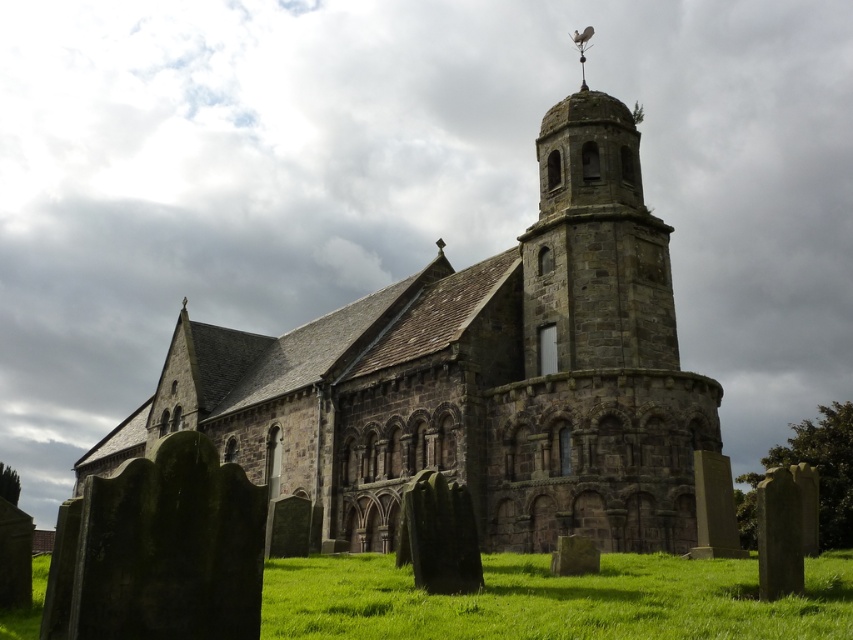
Question: Which point is farther to the camera?

Choices:
 (A) green grass at lower center
 (B) brown stone church at center

Answer: (B)

Question: Which point is farther to the camera?

Choices:
 (A) green grass at lower center
 (B) brown stone church at center

Answer: (B)

Question: Does brown stone church at center have a smaller size compared to green grass at lower center?

Choices:
 (A) yes
 (B) no

Answer: (B)

Question: Does brown stone church at center have a greater width compared to green grass at lower center?

Choices:
 (A) no
 (B) yes

Answer: (B)

Question: Is brown stone church at center below green grass at lower center?

Choices:
 (A) yes
 (B) no

Answer: (B)